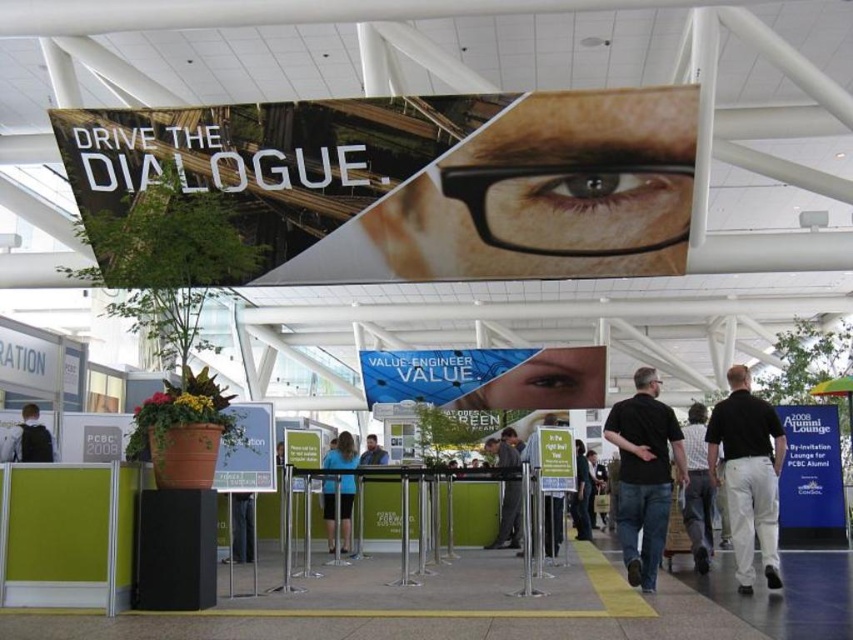
Question: Which point is closer to the camera taking this photo?

Choices:
 (A) (367, 436)
 (B) (326, 500)
 (C) (598, 376)
 (D) (630, 205)

Answer: (B)

Question: Where is smooth blue eye at center located in relation to matte black shirt at center in the image?

Choices:
 (A) above
 (B) below

Answer: (A)

Question: Does smooth blue eye at center appear over matte black shirt at center?

Choices:
 (A) no
 (B) yes

Answer: (B)

Question: Which of these objects is positioned farthest from the matte black shirt at center?

Choices:
 (A) dark blue shirt at center
 (B) plaid shirt at center
 (C) black shirt at center

Answer: (B)

Question: Is black shirt at center to the left of matte black shirt at center from the viewer's perspective?

Choices:
 (A) no
 (B) yes

Answer: (A)

Question: Estimate the real-world distances between objects in this image. Which object is farther from the blue fabric shirt at center?

Choices:
 (A) matte black shirt at center
 (B) dark gray suit at center

Answer: (B)